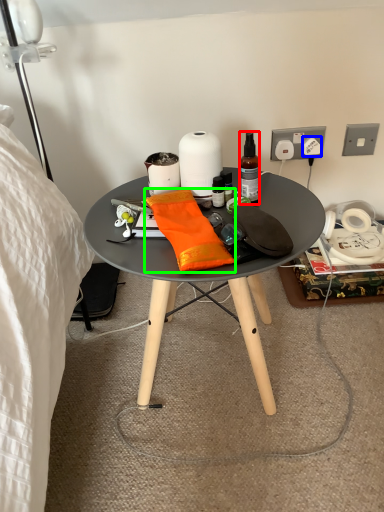
Question: Considering the real-world distances, which object is closest to bottle (highlighted by a red box)? power outlet (highlighted by a blue box) or material (highlighted by a green box).

Choices:
 (A) power outlet
 (B) material

Answer: (B)